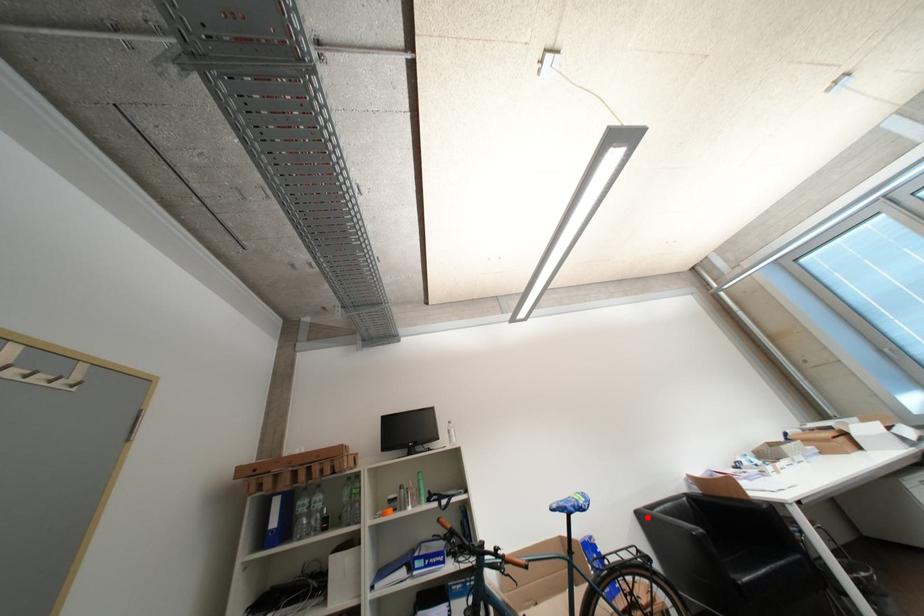
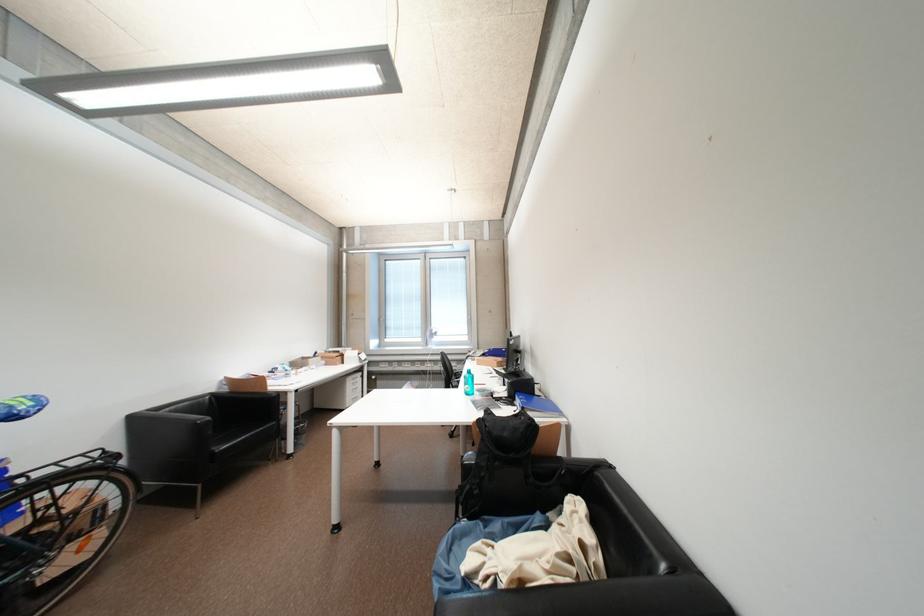
Where in the second image is the point corresponding to the highlighted location from the first image?

(141, 421)